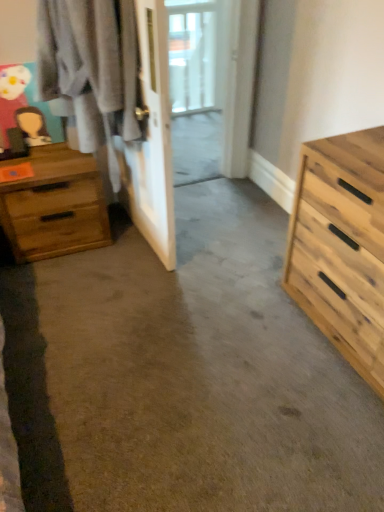
What do you see at coordinates (54, 205) in the screenshot? I see `wooden chest of drawers at left, which ranks as the 1th chest of drawers in back-to-front order` at bounding box center [54, 205].

The height and width of the screenshot is (512, 384). What are the coordinates of `natural wood chest of drawers at right, the 2th chest of drawers in the back-to-front sequence` in the screenshot? It's located at (342, 246).

Image resolution: width=384 pixels, height=512 pixels. Find the location of `closet in front of the clear glass window at center`. closet in front of the clear glass window at center is located at coordinates (152, 141).

Looking at the image, does clear glass window at center seem bigger or smaller compared to wooden dresser at left?

Considering their sizes, clear glass window at center takes up less space than wooden dresser at left.

Is point (212, 54) farther from viewer compared to point (22, 2)?

Yes, it is behind point (22, 2).

From a real-world perspective, is clear glass window at center above or below wooden dresser at left?

clear glass window at center is situated lower than wooden dresser at left in the real world.

From the picture: Does wooden chest of drawers at left, the 2th chest of drawers positioned from the right, have a smaller size compared to natural wood chest of drawers at right, the 2th chest of drawers in the back-to-front sequence?

Yes, wooden chest of drawers at left, the 2th chest of drawers positioned from the right, is smaller than natural wood chest of drawers at right, the 2th chest of drawers in the back-to-front sequence.

Who is shorter, wooden chest of drawers at left, marked as the 1th chest of drawers in a left-to-right arrangement, or natural wood chest of drawers at right, the 2th chest of drawers in the back-to-front sequence?

wooden chest of drawers at left, marked as the 1th chest of drawers in a left-to-right arrangement.

Is point (32, 237) behind point (336, 232)?

That is True.

Does natural wood chest of drawers at right, the 1th chest of drawers when ordered from right to left, lie in front of clear glass window at center?

Yes, natural wood chest of drawers at right, the 1th chest of drawers when ordered from right to left, is in front of clear glass window at center.

In terms of width, does natural wood chest of drawers at right, the 2th chest of drawers in the back-to-front sequence, look wider or thinner when compared to clear glass window at center?

Clearly, natural wood chest of drawers at right, the 2th chest of drawers in the back-to-front sequence, has more width compared to clear glass window at center.

How different are the orientations of natural wood chest of drawers at right, the 1th chest of drawers when ordered from right to left, and clear glass window at center in degrees?

natural wood chest of drawers at right, the 1th chest of drawers when ordered from right to left, and clear glass window at center are facing 88.2 degrees away from each other.

From a real-world perspective, is natural wood chest of drawers at right, the 1th chest of drawers when ordered from right to left, on clear glass window at center?

No, from a real-world perspective, natural wood chest of drawers at right, the 1th chest of drawers when ordered from right to left, is not on top of clear glass window at center.

Who is taller, clear glass window at center or natural wood chest of drawers at right, marked as the first chest of drawers in a front-to-back arrangement?

With more height is clear glass window at center.

Is clear glass window at center not close to natural wood chest of drawers at right, placed as the second chest of drawers when sorted from left to right?

Yes, clear glass window at center and natural wood chest of drawers at right, placed as the second chest of drawers when sorted from left to right, are quite far apart.

Locate an element on the screen. The image size is (384, 512). window above the natural wood chest of drawers at right, the 1th chest of drawers when ordered from right to left (from the image's perspective) is located at coordinates (192, 55).

Considering the positions of objects clear glass window at center and natural wood chest of drawers at right, the 1th chest of drawers when ordered from right to left, in the image provided, who is behind, clear glass window at center or natural wood chest of drawers at right, the 1th chest of drawers when ordered from right to left,?

clear glass window at center is more distant.

Between natural wood chest of drawers at right, marked as the first chest of drawers in a front-to-back arrangement, and wooden chest of drawers at left, which ranks as the 2th chest of drawers in front-to-back order, which one appears on the left side from the viewer's perspective?

wooden chest of drawers at left, which ranks as the 2th chest of drawers in front-to-back order, is more to the left.

From the image's perspective, would you say natural wood chest of drawers at right, placed as the second chest of drawers when sorted from left to right, is positioned over wooden chest of drawers at left, which ranks as the 1th chest of drawers in back-to-front order?

No.

Can we say natural wood chest of drawers at right, the 2th chest of drawers in the back-to-front sequence, lies outside wooden chest of drawers at left, which ranks as the 2th chest of drawers in front-to-back order?

Yes, natural wood chest of drawers at right, the 2th chest of drawers in the back-to-front sequence, is not within wooden chest of drawers at left, which ranks as the 2th chest of drawers in front-to-back order.

What are the coordinates of `the chest of drawers above the natural wood chest of drawers at right, the 1th chest of drawers when ordered from right to left (from the image's perspective)` in the screenshot? It's located at (54, 205).

In the scene shown: Is natural wood chest of drawers at right, the 1th chest of drawers when ordered from right to left, far away from wooden dresser at left?

No, natural wood chest of drawers at right, the 1th chest of drawers when ordered from right to left, is in close proximity to wooden dresser at left.

Is natural wood chest of drawers at right, marked as the first chest of drawers in a front-to-back arrangement, wider than wooden dresser at left?

Yes, natural wood chest of drawers at right, marked as the first chest of drawers in a front-to-back arrangement, is wider than wooden dresser at left.

How different are the orientations of natural wood chest of drawers at right, placed as the second chest of drawers when sorted from left to right, and wooden dresser at left in degrees?

They differ by 4.73 degrees in their facing directions.

Considering their positions, is natural wood chest of drawers at right, placed as the second chest of drawers when sorted from left to right, located in front of or behind wooden dresser at left?

natural wood chest of drawers at right, placed as the second chest of drawers when sorted from left to right, is in front of wooden dresser at left.

Is clear glass window at center smaller than wooden chest of drawers at left, which ranks as the 1th chest of drawers in back-to-front order?

Correct, clear glass window at center occupies less space than wooden chest of drawers at left, which ranks as the 1th chest of drawers in back-to-front order.

From the image's perspective, which object appears higher, clear glass window at center or wooden chest of drawers at left, marked as the 1th chest of drawers in a left-to-right arrangement?

clear glass window at center, from the image's perspective.

Is clear glass window at center in front of or behind wooden chest of drawers at left, which ranks as the 1th chest of drawers in back-to-front order, in the image?

In the image, clear glass window at center appears behind wooden chest of drawers at left, which ranks as the 1th chest of drawers in back-to-front order.

Consider the image. How different are the orientations of clear glass window at center and wooden chest of drawers at left, the 2th chest of drawers positioned from the right, in degrees?

The angle between the facing direction of clear glass window at center and the facing direction of wooden chest of drawers at left, the 2th chest of drawers positioned from the right, is 0.212 degrees.

Locate an element on the screen. This screenshot has height=512, width=384. window above the wooden dresser at left (from the image's perspective) is located at coordinates (192, 55).

At what (x,y) coordinates should I click in order to perform the action: click on the chest of drawers below the wooden chest of drawers at left, marked as the 1th chest of drawers in a left-to-right arrangement (from the image's perspective). Please return your answer as a coordinate pair (x, y). The image size is (384, 512). Looking at the image, I should click on 342,246.

When comparing their distances from clear glass window at center, does wooden dresser at left or natural wood chest of drawers at right, the 1th chest of drawers when ordered from right to left, seem further?

natural wood chest of drawers at right, the 1th chest of drawers when ordered from right to left, is positioned further to the anchor clear glass window at center.

Looking at the image, which one is located closer to natural wood chest of drawers at right, the 2th chest of drawers in the back-to-front sequence, wooden chest of drawers at left, which ranks as the 2th chest of drawers in front-to-back order, or wooden dresser at left?

wooden dresser at left lies closer to natural wood chest of drawers at right, the 2th chest of drawers in the back-to-front sequence, than the other object.

Considering their positions, is clear glass window at center positioned further to wooden dresser at left than wooden chest of drawers at left, the 2th chest of drawers positioned from the right?

clear glass window at center is positioned further to the anchor wooden dresser at left.

Considering their positions, is wooden dresser at left positioned closer to wooden chest of drawers at left, the 2th chest of drawers positioned from the right, than clear glass window at center?

The object closer to wooden chest of drawers at left, the 2th chest of drawers positioned from the right, is wooden dresser at left.

Which object lies nearer to the anchor point wooden dresser at left, wooden chest of drawers at left, the 2th chest of drawers positioned from the right, or clear glass window at center?

Among the two, wooden chest of drawers at left, the 2th chest of drawers positioned from the right, is located nearer to wooden dresser at left.

Considering their positions, is clear glass window at center positioned further to natural wood chest of drawers at right, the 1th chest of drawers when ordered from right to left, than wooden chest of drawers at left, marked as the 1th chest of drawers in a left-to-right arrangement?

clear glass window at center is further to natural wood chest of drawers at right, the 1th chest of drawers when ordered from right to left.

When comparing their distances from wooden chest of drawers at left, which ranks as the 2th chest of drawers in front-to-back order, does clear glass window at center or natural wood chest of drawers at right, marked as the first chest of drawers in a front-to-back arrangement, seem further?

The object further to wooden chest of drawers at left, which ranks as the 2th chest of drawers in front-to-back order, is clear glass window at center.

Looking at the image, which one is located closer to clear glass window at center, wooden chest of drawers at left, which ranks as the 2th chest of drawers in front-to-back order, or wooden dresser at left?

Among the two, wooden dresser at left is located nearer to clear glass window at center.

Find the location of a particular element. The image size is (384, 512). closet between natural wood chest of drawers at right, the 2th chest of drawers in the back-to-front sequence, and clear glass window at center from front to back is located at coordinates (152, 141).

You are a GUI agent. You are given a task and a screenshot of the screen. Output one action in this format:
    pyautogui.click(x=<x>, y=<y>)
    Task: Click on the chest of drawers located between natural wood chest of drawers at right, the 2th chest of drawers in the back-to-front sequence, and clear glass window at center in the depth direction
    The height and width of the screenshot is (512, 384).
    Given the screenshot: What is the action you would take?
    click(x=54, y=205)

The image size is (384, 512). In order to click on chest of drawers between wooden dresser at left and clear glass window at center along the z-axis in this screenshot , I will do point(54,205).

This screenshot has height=512, width=384. Identify the location of closet between wooden chest of drawers at left, the 2th chest of drawers positioned from the right, and natural wood chest of drawers at right, the 2th chest of drawers in the back-to-front sequence. (152, 141).